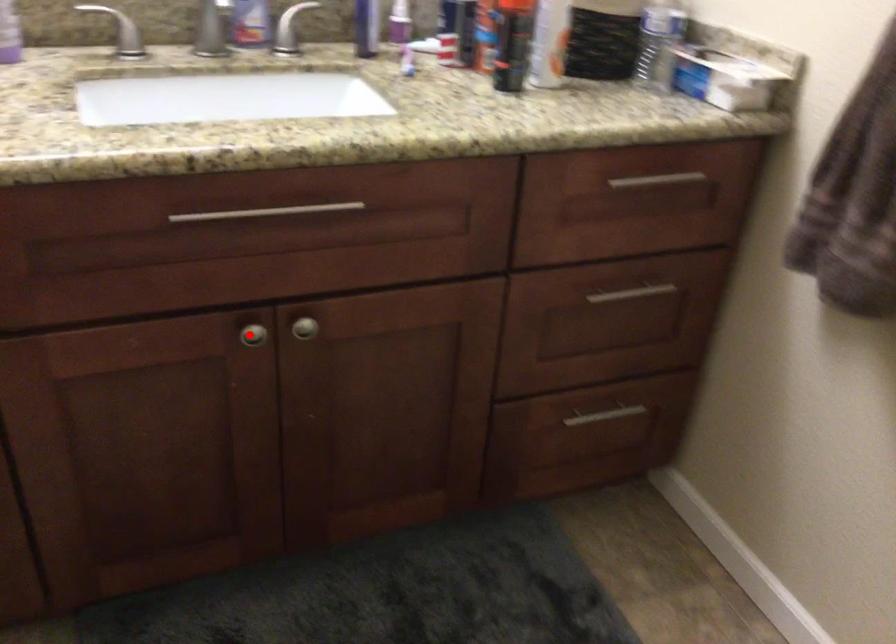
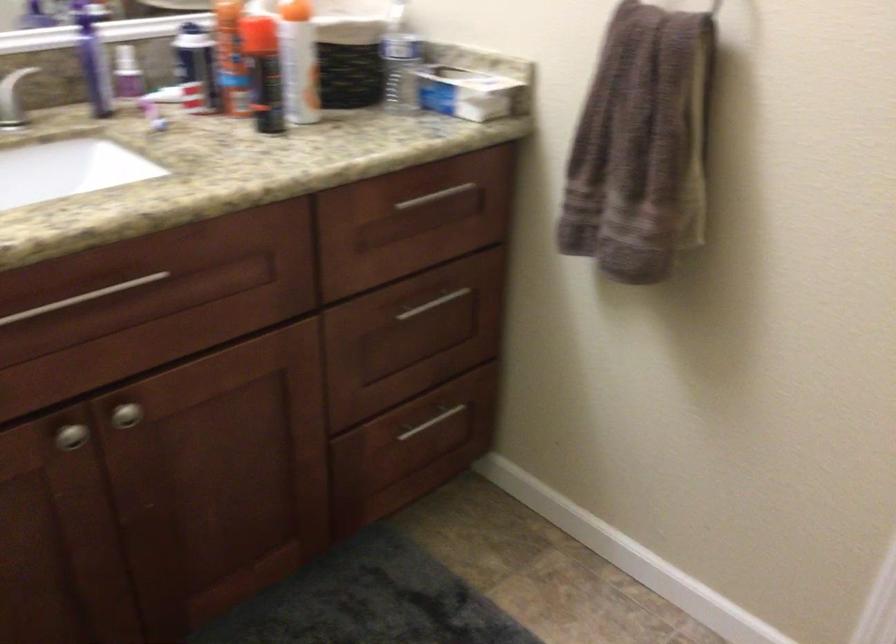
Where in the second image is the point corresponding to the highlighted location from the first image?

(71, 436)